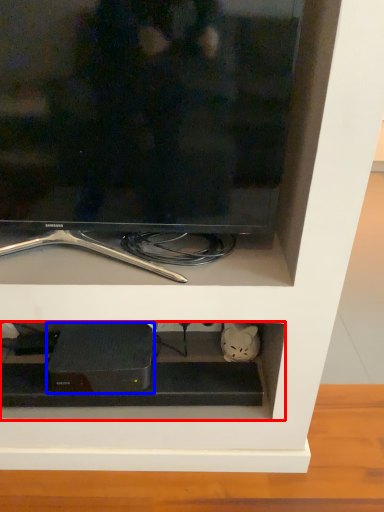
Question: Which of the following is the farthest to the observer, cabinet (highlighted by a red box) or appliance (highlighted by a blue box)?

Choices:
 (A) cabinet
 (B) appliance

Answer: (A)